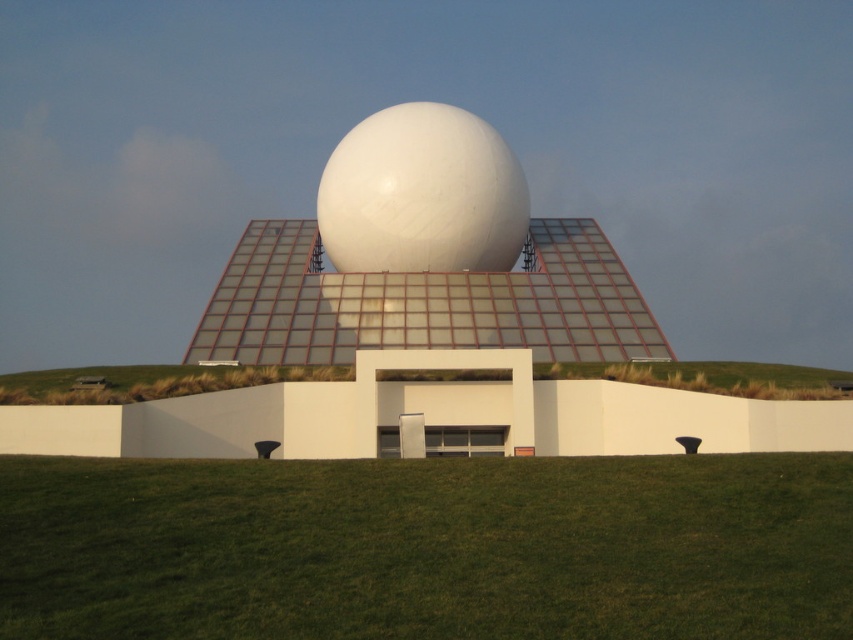
You are a drone operator planning to fly a drone over the green grass at center and under the white glossy sphere at center. Can the drone pass through the space between them?

The green grass at center is positioned under the white glossy sphere at center, so there is no space between them for the drone to pass through.

You are standing in front of the modern architectural structure and want to walk from the green grass at center to the green grass at lower center. Which direction should you move to reach the destination?

To move from the green grass at center to the green grass at lower center, you should move downward since the green grass at lower center is located below the green grass at center.

Consider the image. You are standing in front of the modern architectural structure and see the green grass at center and green grass at lower center. Which area of green grass is more to the right side?

The green grass at center is positioned on the right side of green grass at lower center.